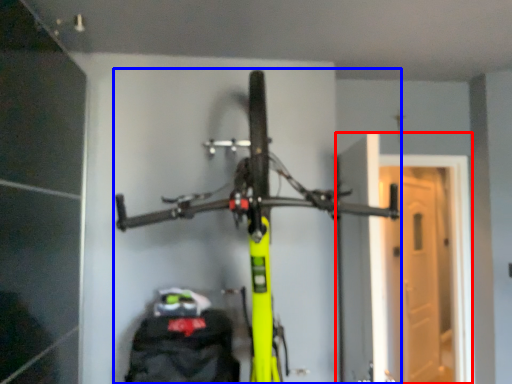
Question: Which object appears farthest to the camera in this image, garage door (highlighted by a red box) or bicycle (highlighted by a blue box)?

Choices:
 (A) garage door
 (B) bicycle

Answer: (A)